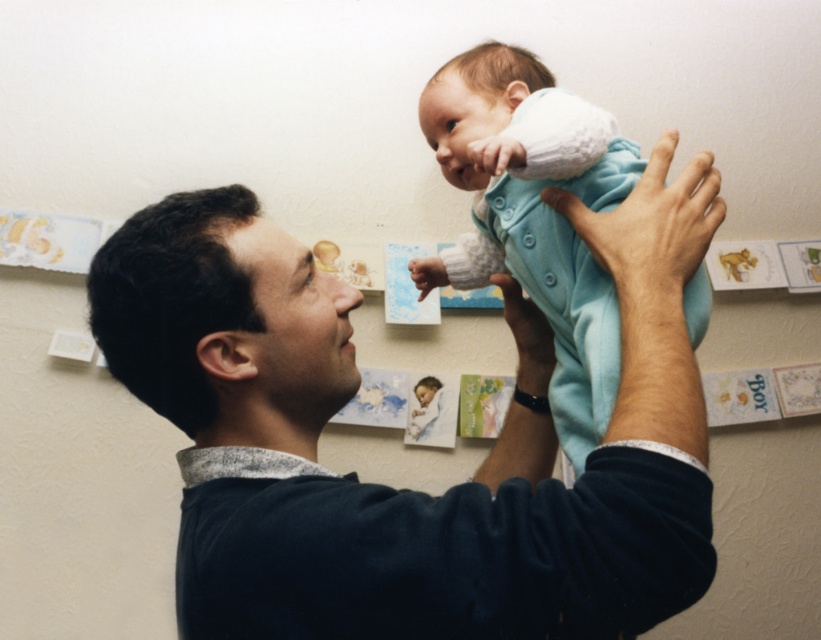
Question: Does dark blue sweater at upper center appear on the left side of light blue fleece onesie at upper center?

Choices:
 (A) no
 (B) yes

Answer: (B)

Question: Which point is closer to the camera?

Choices:
 (A) (186, 406)
 (B) (516, 154)

Answer: (A)

Question: In this image, where is dark blue sweater at upper center located relative to light blue fleece onesie at upper center?

Choices:
 (A) below
 (B) above

Answer: (A)

Question: Can you confirm if dark blue sweater at upper center is positioned above light blue fleece onesie at upper center?

Choices:
 (A) yes
 (B) no

Answer: (B)